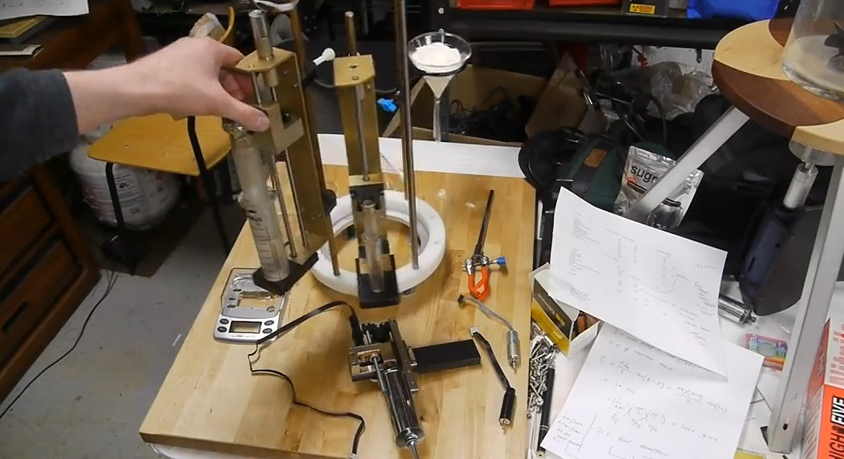
Locate an element on the screen. rectangular brown table is located at coordinates (208, 396).